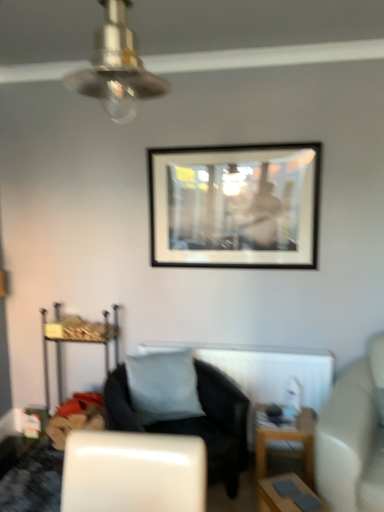
Measure the distance between black fabric chair at center and camera.

The depth of black fabric chair at center is 6.75 feet.

The image size is (384, 512). Find the location of `black fabric chair at center`. black fabric chair at center is located at coordinates (194, 421).

Image resolution: width=384 pixels, height=512 pixels. Describe the element at coordinates (77, 340) in the screenshot. I see `metallic gold dresser at left` at that location.

This screenshot has width=384, height=512. Describe the element at coordinates (353, 437) in the screenshot. I see `white leather couch at right` at that location.

The width and height of the screenshot is (384, 512). Describe the element at coordinates (117, 67) in the screenshot. I see `metallic silver ceiling fan at upper center` at that location.

What do you see at coordinates (235, 206) in the screenshot? I see `black matte picture frame at upper center` at bounding box center [235, 206].

How much space does wooden table at lower right, which is counted as the first table, starting from the back, occupy horizontally?

wooden table at lower right, which is counted as the first table, starting from the back, is 32.52 centimeters wide.

At what (x,y) coordinates should I click in order to perform the action: click on smooth wooden table at lower right, the 1th table in the front-to-back sequence. Please return your answer as a coordinate pair (x, y). This screenshot has height=512, width=384. Looking at the image, I should click on (287, 495).

From a real-world perspective, is white matte radiator at center positioned above or below white matte pillow at center?

Clearly, from a real-world perspective, white matte radiator at center is below white matte pillow at center.

Consider the image. From their relative heights in the image, would you say white matte radiator at center is taller or shorter than white matte pillow at center?

Considering their sizes, white matte radiator at center has less height than white matte pillow at center.

Is white matte radiator at center turned away from white matte pillow at center?

That's right, white matte radiator at center is facing away from white matte pillow at center.

Considering the sizes of objects white matte radiator at center and black fabric chair at center in the image provided, who is wider, white matte radiator at center or black fabric chair at center?

black fabric chair at center.

In the scene shown: Is there a large distance between white matte radiator at center and black fabric chair at center?

No, there isn't a large distance between white matte radiator at center and black fabric chair at center.

Considering the sizes of objects white matte radiator at center and black fabric chair at center in the image provided, who is bigger, white matte radiator at center or black fabric chair at center?

Bigger between the two is black fabric chair at center.

The width and height of the screenshot is (384, 512). What are the coordinates of `chair lying in front of the white matte radiator at center` in the screenshot? It's located at (194, 421).

Is white matte pillow at center oriented towards white matte radiator at center?

No, white matte pillow at center is not facing towards white matte radiator at center.

Between white matte pillow at center and white matte radiator at center, which one has smaller width?

With smaller width is white matte radiator at center.

From the picture: Does white matte pillow at center appear on the right side of white matte radiator at center?

No.

In the image, there is a white matte pillow at center. Where is `radiator below it (from the image's perspective)`? radiator below it (from the image's perspective) is located at coordinates (264, 369).

Considering the sizes of objects white leather couch at right and white matte radiator at center in the image provided, who is taller, white leather couch at right or white matte radiator at center?

white leather couch at right is taller.

Would you say white leather couch at right contains white matte radiator at center?

Definitely not — white matte radiator at center is not inside white leather couch at right.

The height and width of the screenshot is (512, 384). Find the location of `studio couch below the white matte radiator at center (from the image's perspective)`. studio couch below the white matte radiator at center (from the image's perspective) is located at coordinates (353, 437).

Can you tell me how much white leather couch at right and white matte radiator at center differ in facing direction?

The facing directions of white leather couch at right and white matte radiator at center are 21 degrees apart.

From the picture: Does black fabric chair at center have a greater width compared to metallic silver ceiling fan at upper center?

Yes, black fabric chair at center is wider than metallic silver ceiling fan at upper center.

Are black fabric chair at center and metallic silver ceiling fan at upper center far apart?

Yes, black fabric chair at center and metallic silver ceiling fan at upper center are located far from each other.

Considering the relative positions of black fabric chair at center and metallic silver ceiling fan at upper center in the image provided, is black fabric chair at center behind metallic silver ceiling fan at upper center?

Yes, it is.

Identify the location of table in front of the black fabric chair at center. The image size is (384, 512). [287, 495].

Is black fabric chair at center turned away from smooth wooden table at lower right, the second table when ordered from back to front?

No, smooth wooden table at lower right, the second table when ordered from back to front, is not at the back of black fabric chair at center.

Between point (236, 476) and point (304, 508), which one is positioned in front?

The point (304, 508) is closer.

Does black fabric chair at center have a greater height compared to smooth wooden table at lower right, the 1th table in the front-to-back sequence?

Correct, black fabric chair at center is much taller as smooth wooden table at lower right, the 1th table in the front-to-back sequence.

Is white matte pillow at center positioned far away from wooden table at lower right, which is counted as the first table, starting from the back?

They are positioned close to each other.

From the image's perspective, is white matte pillow at center located above wooden table at lower right, which is counted as the first table, starting from the back?

Yes, from the image's perspective, white matte pillow at center is on top of wooden table at lower right, which is counted as the first table, starting from the back.

Considering the relative positions of white matte pillow at center and wooden table at lower right, which is counted as the first table, starting from the back, in the image provided, is white matte pillow at center to the left or to the right of wooden table at lower right, which is counted as the first table, starting from the back,?

Clearly, white matte pillow at center is on the left of wooden table at lower right, which is counted as the first table, starting from the back, in the image.

How distant is white matte pillow at center from wooden table at lower right, the second table from the front?

white matte pillow at center and wooden table at lower right, the second table from the front, are 22.91 inches apart from each other.

You are a GUI agent. You are given a task and a screenshot of the screen. Output one action in this format:
    pyautogui.click(x=<x>, y=<y>)
    Task: Click on the pillow above the white matte radiator at center (from a real-world perspective)
    The image size is (384, 512).
    Given the screenshot: What is the action you would take?
    pyautogui.click(x=163, y=386)

Find the location of a particular element. The image size is (384, 512). chair below the white matte radiator at center (from a real-world perspective) is located at coordinates (194, 421).

Based on their spatial positions, is white matte pillow at center or black matte picture frame at upper center further from smooth wooden table at lower right, the 1th table in the front-to-back sequence?

black matte picture frame at upper center lies further to smooth wooden table at lower right, the 1th table in the front-to-back sequence, than the other object.

Which object lies further to the anchor point smooth wooden table at lower right, the second table when ordered from back to front, white matte pillow at center or metallic silver ceiling fan at upper center?

metallic silver ceiling fan at upper center is further to smooth wooden table at lower right, the second table when ordered from back to front.

Considering their positions, is wooden table at lower right, the second table from the front, positioned further to white matte pillow at center than smooth wooden table at lower right, the 1th table in the front-to-back sequence?

smooth wooden table at lower right, the 1th table in the front-to-back sequence, is positioned further to the anchor white matte pillow at center.

From the picture: When comparing their distances from wooden table at lower right, the second table from the front, does white leather couch at right or white matte radiator at center seem further?

white matte radiator at center is further to wooden table at lower right, the second table from the front.

From the image, which object appears to be nearer to white leather couch at right, metallic silver ceiling fan at upper center or black fabric chair at center?

black fabric chair at center lies closer to white leather couch at right than the other object.

Looking at the image, which one is located further to white matte radiator at center, smooth wooden table at lower right, the second table when ordered from back to front, or wooden table at lower right, the second table from the front?

Among the two, smooth wooden table at lower right, the second table when ordered from back to front, is located further to white matte radiator at center.

When comparing their distances from wooden table at lower right, which is counted as the first table, starting from the back, does metallic gold dresser at left or black fabric chair at center seem further?

Based on the image, metallic gold dresser at left appears to be further to wooden table at lower right, which is counted as the first table, starting from the back.

Looking at the image, which one is located closer to white matte pillow at center, black matte picture frame at upper center or smooth wooden table at lower right, the second table when ordered from back to front?

smooth wooden table at lower right, the second table when ordered from back to front, lies closer to white matte pillow at center than the other object.

You are a GUI agent. You are given a task and a screenshot of the screen. Output one action in this format:
    pyautogui.click(x=<x>, y=<y>)
    Task: Click on the studio couch between metallic silver ceiling fan at upper center and smooth wooden table at lower right, the 1th table in the front-to-back sequence, from top to bottom
    The image size is (384, 512).
    Given the screenshot: What is the action you would take?
    pyautogui.click(x=353, y=437)

Where is `pillow between black matte picture frame at upper center and white matte radiator at center in the up-down direction`? pillow between black matte picture frame at upper center and white matte radiator at center in the up-down direction is located at coordinates (163, 386).

What are the coordinates of `studio couch between metallic silver ceiling fan at upper center and black matte picture frame at upper center in the front-back direction` in the screenshot? It's located at (353, 437).

The height and width of the screenshot is (512, 384). I want to click on studio couch that lies between black matte picture frame at upper center and wooden table at lower right, which is counted as the first table, starting from the back, from top to bottom, so click(x=353, y=437).